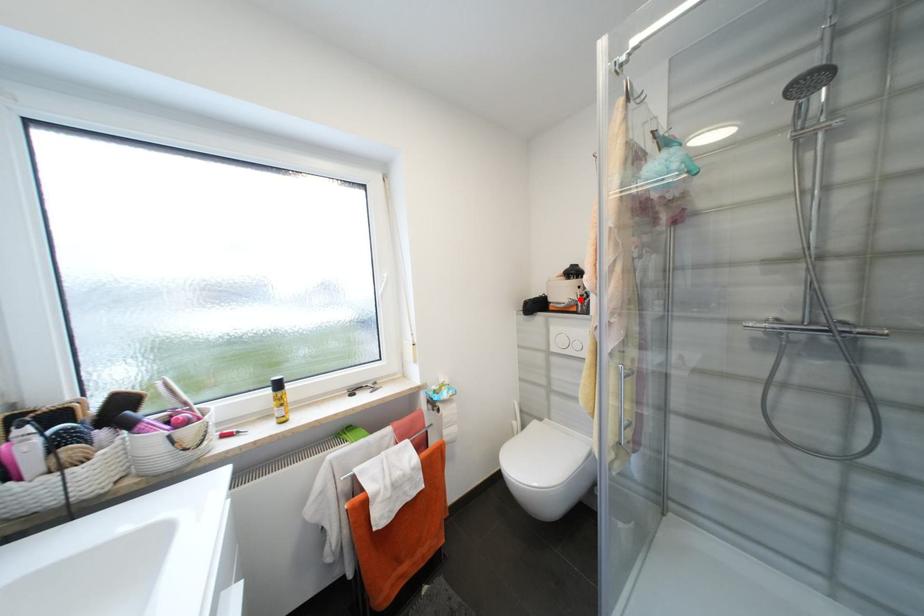
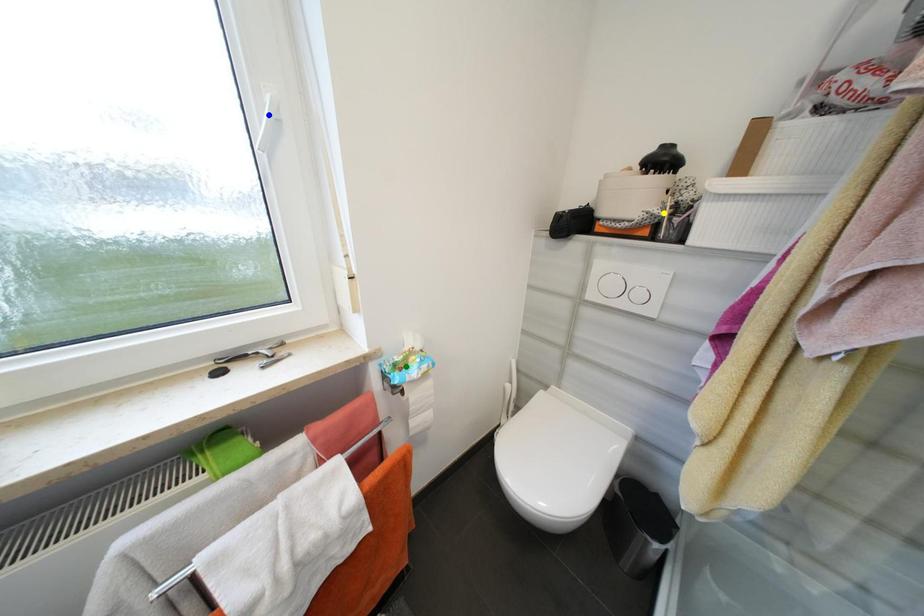
Question: I am providing you with two images of the same scene from different viewpoints. A red point is marked on the first image. You are given multiple points on the second image. Which spot in image 2 lines up with the point in image 1?

Choices:
 (A) yellow point
 (B) green point
 (C) blue point

Answer: (A)